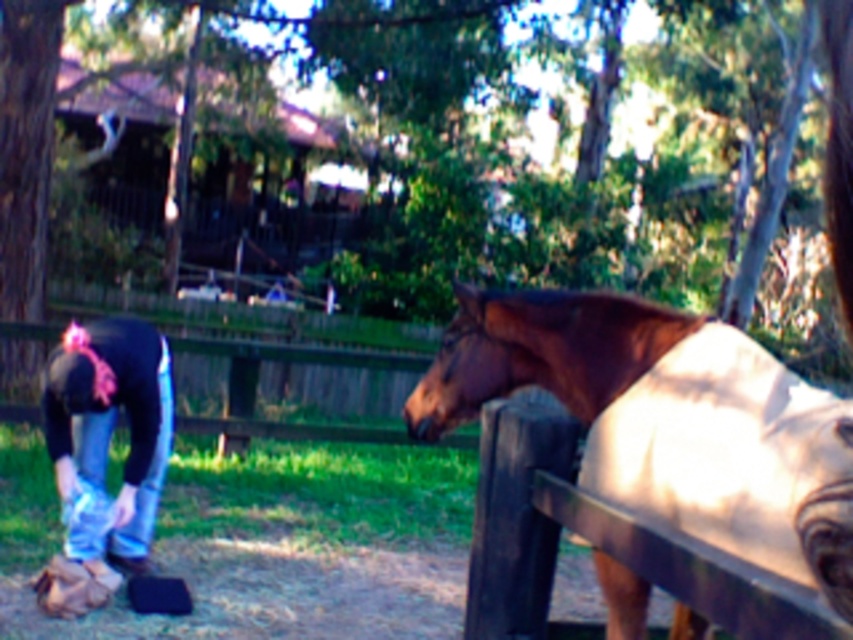
Based on the photo, you are standing at the point marked by the coordinates point (548, 352). Looking around, you see a person and a horse near a wooden fence. Which direction should you move to reach the brown glossy horse at right?

The point marked by the coordinates point (548, 352) already marks the brown glossy horse at right, so you are already at the correct location.

You are standing at the center of the scene. You see a brown glossy horse at right and blue jeans at lower left. Which object is located to the right side of the other?

The brown glossy horse at right is to the right of blue jeans at lower left.

You are standing at the center of the image. The brown glossy horse at right is located at coordinates approximately 0.550 on the x axis and 0.644 on the y axis. If you want to approach the horse, which direction should you move? Please specify the direction in terms of left, right, forward, or backward based on your current position at the center.

Since you are at the center of the image and the brown glossy horse at right is at coordinates x 0.550 and y 0.644, you should move to the right and forward to reach it. The x coordinate 0.550 indicates the right side of the image, while the y coordinate 0.644 suggests a forward direction from the center.